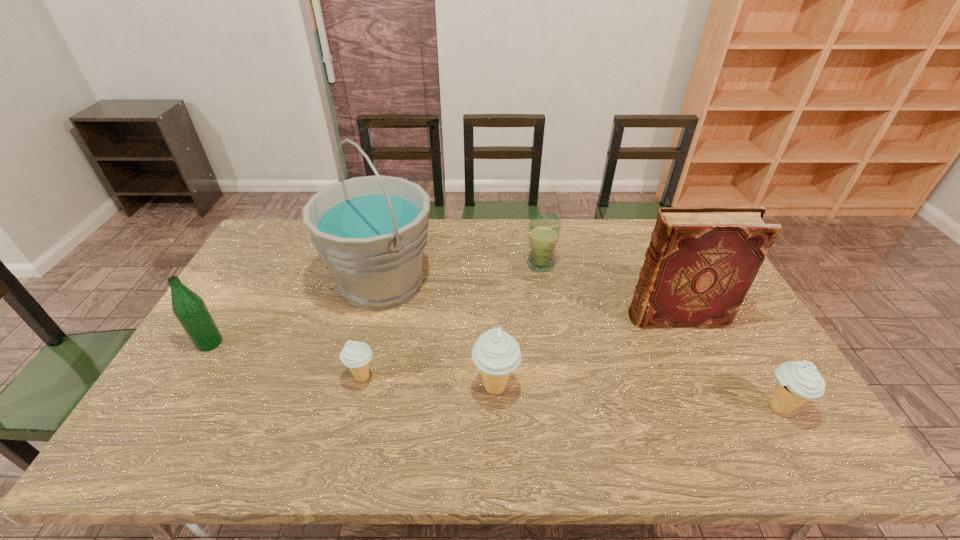
Where is `empty space that is in between the tallest icecream and the bucket`? empty space that is in between the tallest icecream and the bucket is located at coordinates (439, 335).

The width and height of the screenshot is (960, 540). What are the coordinates of `vacant space that is in between the rightmost icecream and the fifth object from left to right` in the screenshot? It's located at (660, 336).

Find the location of `unoccupied area between the sixth shortest object and the shortest icecream`. unoccupied area between the sixth shortest object and the shortest icecream is located at coordinates (519, 347).

Locate an element on the screen. Image resolution: width=960 pixels, height=540 pixels. free space between the bottle and the second tallest object is located at coordinates (443, 330).

Where is `free space between the bottle and the second tallest object`? This screenshot has height=540, width=960. free space between the bottle and the second tallest object is located at coordinates (443, 330).

Identify the location of free space between the rightmost icecream and the glass. This screenshot has width=960, height=540. (660, 336).

Image resolution: width=960 pixels, height=540 pixels. Find the location of `free area in between the rightmost icecream and the shortest icecream`. free area in between the rightmost icecream and the shortest icecream is located at coordinates (570, 393).

Locate an element on the screen. object that ranks as the fifth closest to the third object from right to left is located at coordinates [798, 381].

Find the location of a particular element. object that is the second closest to the second tallest object is located at coordinates (544, 228).

Locate an element on the screen. The image size is (960, 540). icecream object that ranks as the second closest to the second shortest icecream is located at coordinates (356, 355).